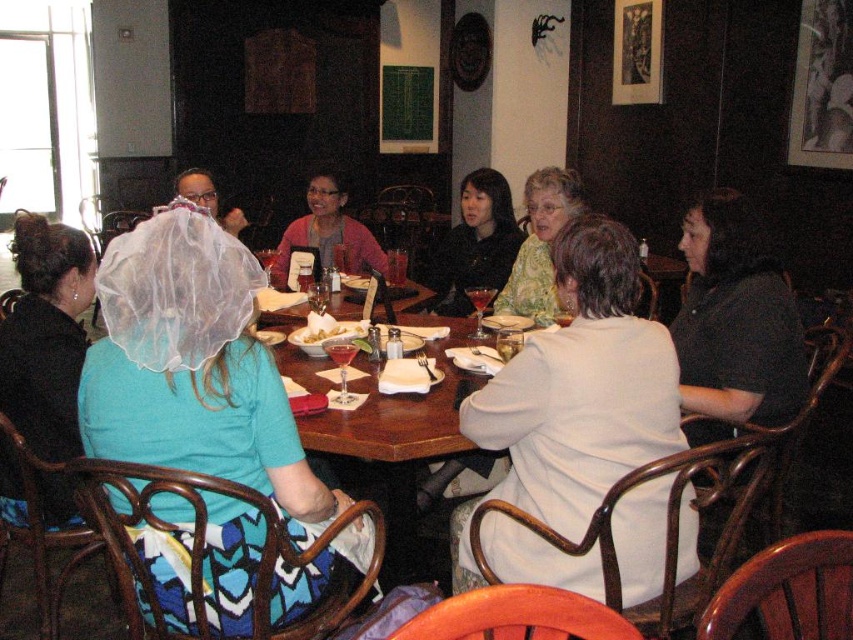
Does point (451, 232) lie in front of point (357, 323)?

No, it is behind (357, 323).

Is point (471, 262) in front of point (347, 337)?

That is False.

Locate an element on the screen. The image size is (853, 640). matte black dress at center is located at coordinates (474, 244).

Is black matte shirt at right positioned in front of smooth white bowl at center?

Yes.

Can you confirm if black matte shirt at right is smaller than smooth white bowl at center?

Actually, black matte shirt at right might be larger than smooth white bowl at center.

Between point (711, 300) and point (302, 326), which one is positioned in front?

Point (711, 300)

In order to click on black matte shirt at right in this screenshot , I will do tap(735, 323).

Can you confirm if white cotton blouse at center is positioned below floral print blouse at center?

Correct, white cotton blouse at center is located below floral print blouse at center.

Between white cotton blouse at center and floral print blouse at center, which one has less height?

Standing shorter between the two is floral print blouse at center.

This screenshot has height=640, width=853. Find the location of `white cotton blouse at center`. white cotton blouse at center is located at coordinates (581, 387).